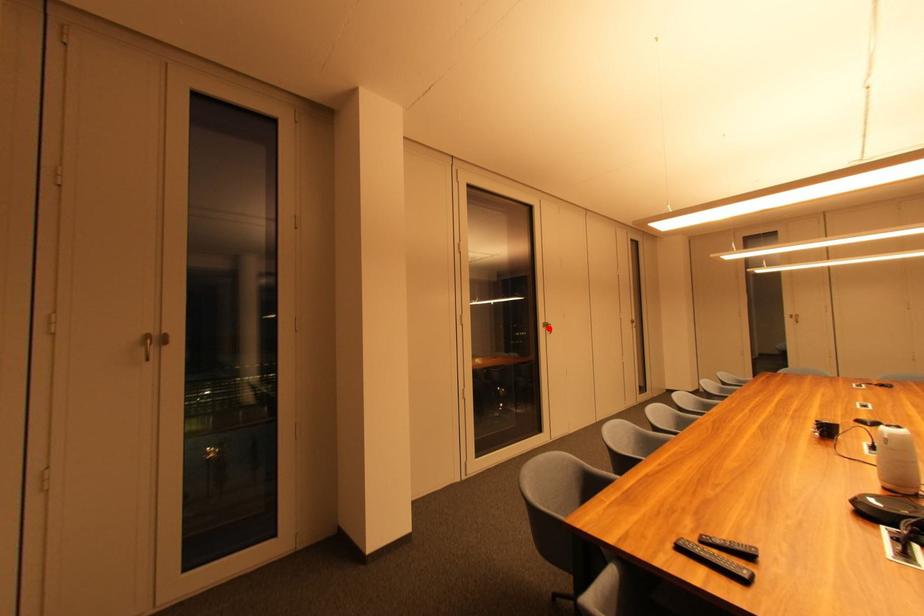
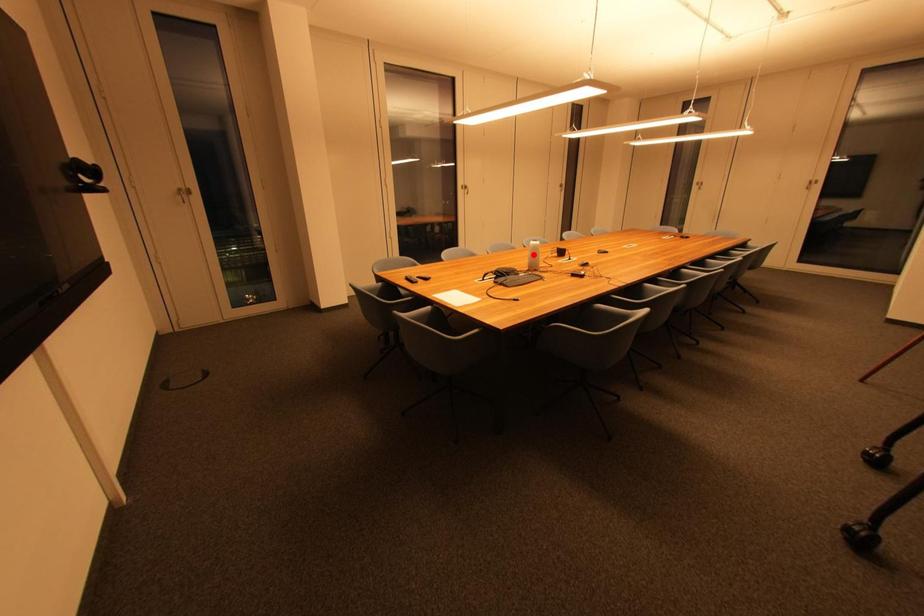
I am providing you with two images of the same scene from different viewpoints. A red point is marked on the first image and another point is marked on the second image. Does the point marked in image1 correspond to the same location as the one in image2?

No